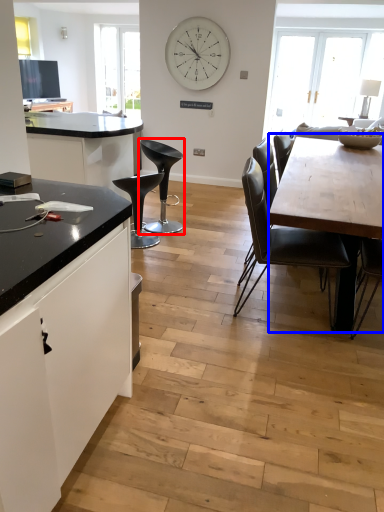
Question: Among these objects, which one is farthest to the camera, chair (highlighted by a red box) or round table (highlighted by a blue box)?

Choices:
 (A) chair
 (B) round table

Answer: (A)